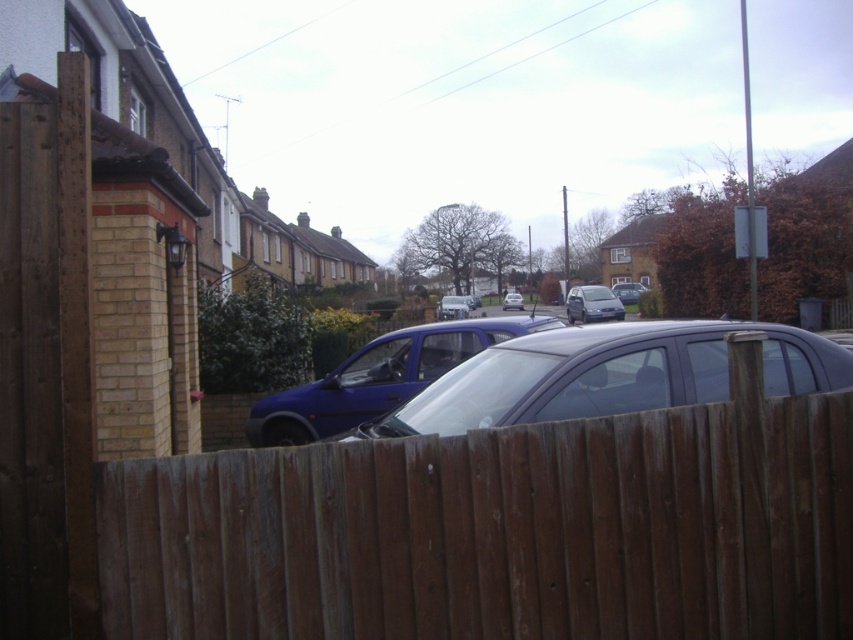
Question: Which point is farther to the camera?

Choices:
 (A) satin silver hatchback at center
 (B) blue metallic van at center

Answer: (A)

Question: Does matte blue car at center appear on the left side of matte gray van at center?

Choices:
 (A) yes
 (B) no

Answer: (A)

Question: Can you confirm if brown wooden fence at center is wider than satin silver sedan at center?

Choices:
 (A) yes
 (B) no

Answer: (A)

Question: Considering the real-world distances, which object is farthest from the blue metallic van at center?

Choices:
 (A) satin silver hatchback at center
 (B) satin silver sedan at center

Answer: (B)

Question: Can you confirm if blue metallic van at center is smaller than matte gray van at center?

Choices:
 (A) no
 (B) yes

Answer: (A)

Question: Based on their relative distances, which object is nearer to the blue metallic van at center?

Choices:
 (A) matte blue car at center
 (B) satin silver sedan at center
 (C) satin silver hatchback at center
 (D) matte black car at center

Answer: (C)